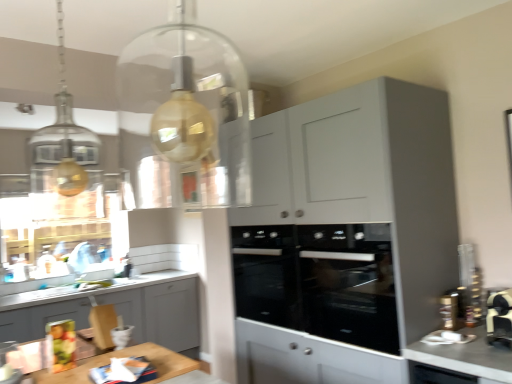
Question: Is white glossy countertop at lower right bigger than matte gray cabinet at lower left, which ranks as the 2th cabinetry in right-to-left order?

Choices:
 (A) no
 (B) yes

Answer: (A)

Question: Is white glossy countertop at lower right thinner than matte gray cabinet at lower left, the first cabinetry viewed from the left?

Choices:
 (A) no
 (B) yes

Answer: (B)

Question: Is white glossy countertop at lower right looking in the opposite direction of matte gray cabinet at lower left, which ranks as the 2th cabinetry in right-to-left order?

Choices:
 (A) no
 (B) yes

Answer: (A)

Question: Could you tell me if white glossy countertop at lower right is facing matte gray cabinet at lower left, the first cabinetry viewed from the left?

Choices:
 (A) no
 (B) yes

Answer: (A)

Question: From a real-world perspective, is white glossy countertop at lower right beneath matte gray cabinet at lower left, which ranks as the 2th cabinetry in right-to-left order?

Choices:
 (A) yes
 (B) no

Answer: (B)

Question: Considering the relative sizes of white glossy countertop at lower right and matte gray cabinet at lower left, which ranks as the 2th cabinetry in right-to-left order, in the image provided, is white glossy countertop at lower right smaller than matte gray cabinet at lower left, which ranks as the 2th cabinetry in right-to-left order,?

Choices:
 (A) no
 (B) yes

Answer: (B)

Question: Considering the relative positions of matte gray cabinet at upper right, the 1th cabinetry from the front, and black glass oven at center in the image provided, is matte gray cabinet at upper right, the 1th cabinetry from the front, in front of black glass oven at center?

Choices:
 (A) yes
 (B) no

Answer: (A)

Question: Is the surface of matte gray cabinet at upper right, placed as the second cabinetry when sorted from left to right, in direct contact with black glass oven at center?

Choices:
 (A) yes
 (B) no

Answer: (B)

Question: Would you say matte gray cabinet at upper right, the second cabinetry in the back-to-front sequence, is outside black glass oven at center?

Choices:
 (A) no
 (B) yes

Answer: (B)

Question: Could you tell me if matte gray cabinet at upper right, the 1th cabinetry from the front, is facing black glass oven at center?

Choices:
 (A) yes
 (B) no

Answer: (A)

Question: Can you confirm if matte gray cabinet at upper right, which is the first cabinetry in right-to-left order, is taller than black glass oven at center?

Choices:
 (A) no
 (B) yes

Answer: (B)

Question: Is matte gray cabinet at upper right, placed as the second cabinetry when sorted from left to right, positioned with its back to black glass oven at center?

Choices:
 (A) no
 (B) yes

Answer: (B)

Question: Considering the relative positions of matte gray cabinet at lower left, which ranks as the 2th cabinetry in right-to-left order, and white glossy countertop at lower right in the image provided, is matte gray cabinet at lower left, which ranks as the 2th cabinetry in right-to-left order, to the left of white glossy countertop at lower right from the viewer's perspective?

Choices:
 (A) no
 (B) yes

Answer: (B)